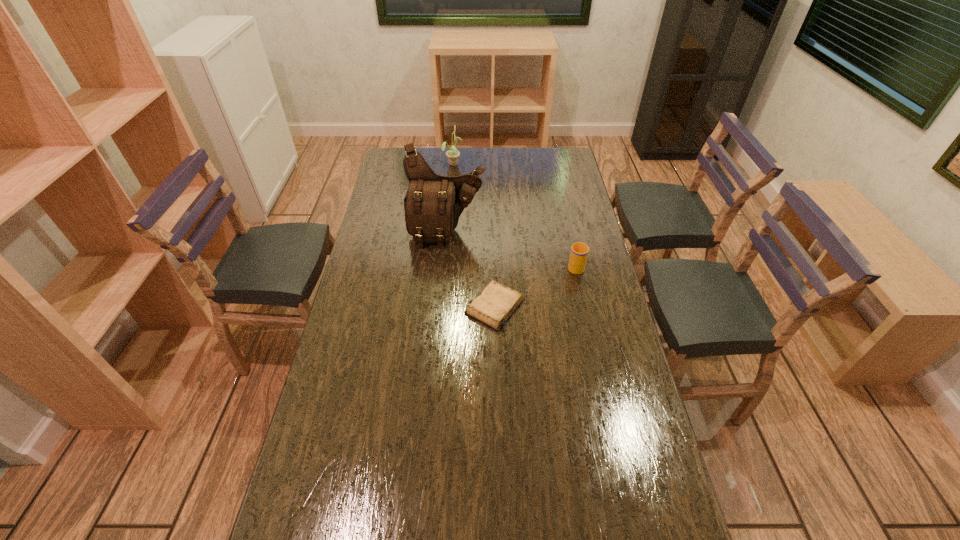
Locate an element on the screen. vacant space that satisfies the following two spatial constraints: 1. on the front-facing side of the farthest object; 2. on the side of the cup with the handle is located at coordinates (444, 267).

Identify the location of free space that satisfies the following two spatial constraints: 1. on the side of the second nearest object with the handle; 2. on the front-facing side of the third shortest object. (553, 163).

Find the location of a particular element. vacant region that satisfies the following two spatial constraints: 1. on the front-facing side of the farthest object; 2. on the side of the second shortest object with the handle is located at coordinates (444, 267).

The width and height of the screenshot is (960, 540). What are the coordinates of `free space that satisfies the following two spatial constraints: 1. on the side of the second shortest object with the handle; 2. on the front-facing side of the third shortest object` in the screenshot? It's located at (553, 163).

I want to click on vacant space that satisfies the following two spatial constraints: 1. on the front-facing side of the nearest object; 2. on the right side of the tallest object, so click(441, 306).

Image resolution: width=960 pixels, height=540 pixels. Find the location of `vacant space that satisfies the following two spatial constraints: 1. on the front-facing side of the shoulder bag; 2. on the right side of the shortest object`. vacant space that satisfies the following two spatial constraints: 1. on the front-facing side of the shoulder bag; 2. on the right side of the shortest object is located at coordinates (441, 306).

Identify the location of free point that satisfies the following two spatial constraints: 1. on the back side of the diary; 2. on the front-facing side of the sunflower. (491, 163).

The height and width of the screenshot is (540, 960). I want to click on free spot that satisfies the following two spatial constraints: 1. on the front-facing side of the diary; 2. on the right side of the sunflower, so click(441, 306).

Locate an element on the screen. The image size is (960, 540). vacant area that satisfies the following two spatial constraints: 1. on the front-facing side of the diary; 2. on the right side of the tallest object is located at coordinates (441, 306).